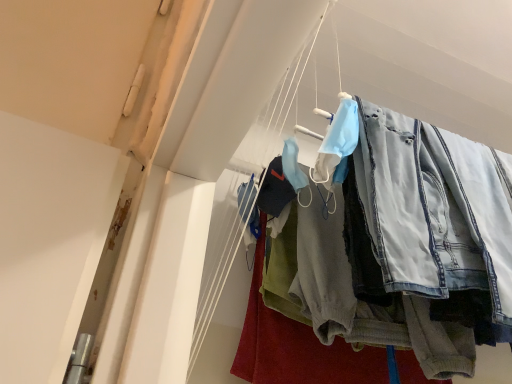
Question: Is denim pants at center further to the viewer compared to denim jeans at upper right?

Choices:
 (A) no
 (B) yes

Answer: (B)

Question: Is denim pants at center not near denim jeans at upper right?

Choices:
 (A) yes
 (B) no

Answer: (B)

Question: Could you tell me if denim pants at center is facing denim jeans at upper right?

Choices:
 (A) no
 (B) yes

Answer: (B)

Question: Can you confirm if denim pants at center is bigger than denim jeans at upper right?

Choices:
 (A) yes
 (B) no

Answer: (A)

Question: Is denim pants at center closer to the viewer compared to denim jeans at upper right?

Choices:
 (A) no
 (B) yes

Answer: (A)

Question: Considering the relative sizes of denim pants at center and denim jeans at upper right in the image provided, is denim pants at center thinner than denim jeans at upper right?

Choices:
 (A) yes
 (B) no

Answer: (B)

Question: Is the surface of denim jeans at upper right in direct contact with denim pants at center?

Choices:
 (A) no
 (B) yes

Answer: (B)

Question: Is denim jeans at upper right bigger than denim pants at center?

Choices:
 (A) no
 (B) yes

Answer: (A)

Question: Is denim jeans at upper right not inside denim pants at center?

Choices:
 (A) no
 (B) yes

Answer: (B)

Question: From the image's perspective, would you say denim jeans at upper right is shown under denim pants at center?

Choices:
 (A) no
 (B) yes

Answer: (A)

Question: From a real-world perspective, is denim jeans at upper right located higher than denim pants at center?

Choices:
 (A) yes
 (B) no

Answer: (A)

Question: Is denim jeans at upper right to the right of denim pants at center from the viewer's perspective?

Choices:
 (A) no
 (B) yes

Answer: (B)

Question: Is denim jeans at upper right taller or shorter than denim pants at center?

Choices:
 (A) short
 (B) tall

Answer: (A)